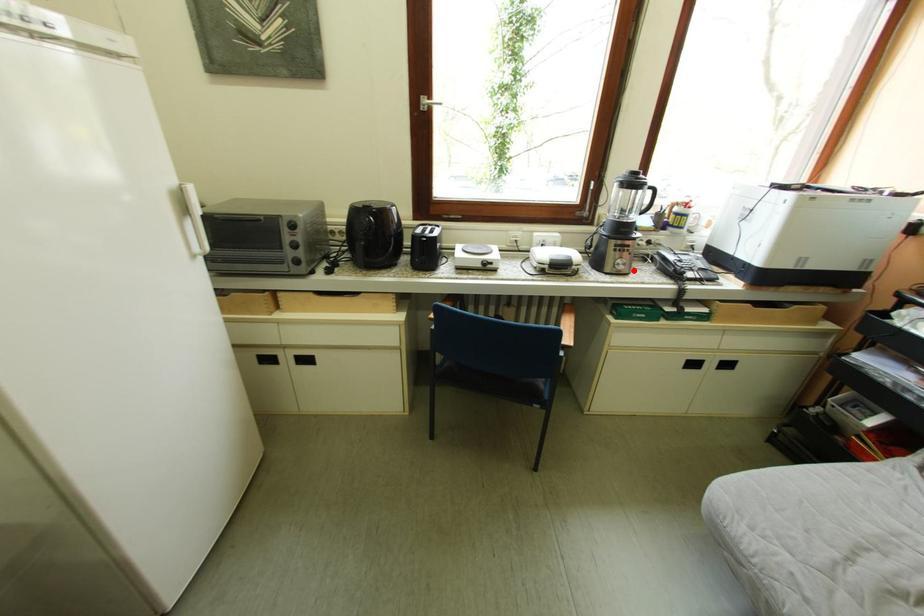
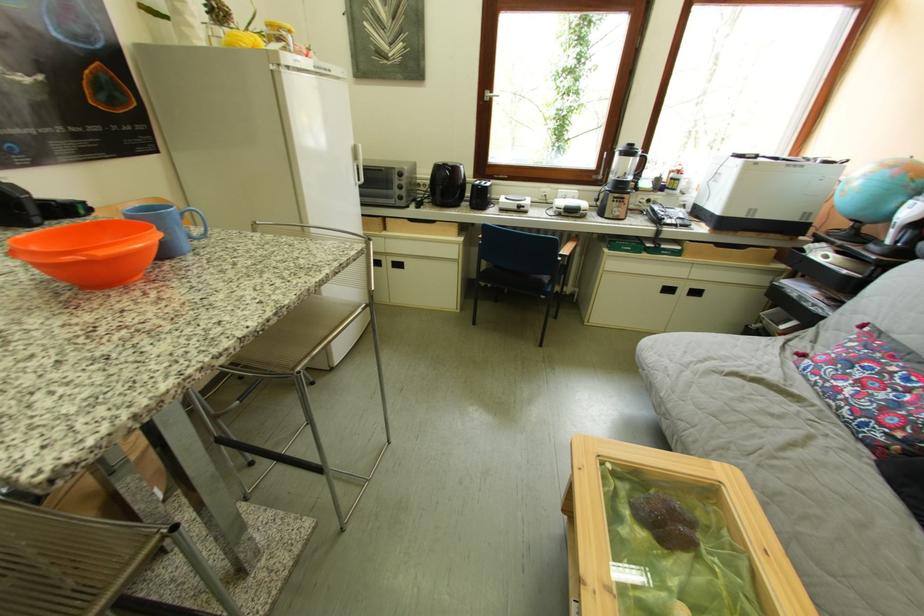
Find the pixel in the second image that matches the highlighted location in the first image.

(629, 217)